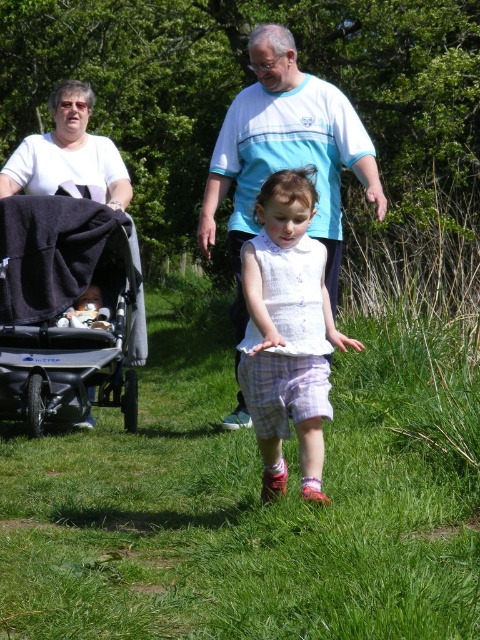
Question: Does light blue cotton shirt at center come behind white cotton t-shirt at upper left?

Choices:
 (A) yes
 (B) no

Answer: (B)

Question: Estimate the real-world distances between objects in this image. Which object is closer to the light blue cotton shirt at center?

Choices:
 (A) white cotton dress at center
 (B) white cotton t-shirt at upper left

Answer: (B)

Question: Which object appears closest to the camera in this image?

Choices:
 (A) silver metallic stroller at left
 (B) white cotton t-shirt at upper left

Answer: (A)

Question: Is white cotton dress at center above white cotton t-shirt at upper left?

Choices:
 (A) yes
 (B) no

Answer: (B)

Question: Does light blue cotton shirt at center lie in front of white cotton t-shirt at upper left?

Choices:
 (A) yes
 (B) no

Answer: (A)

Question: Among these points, which one is farthest from the camera?

Choices:
 (A) (298, 92)
 (B) (80, 136)
 (C) (288, 410)

Answer: (B)